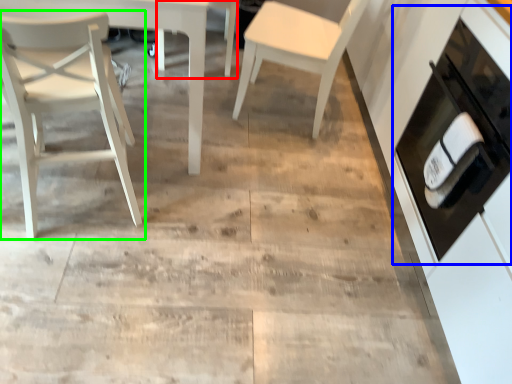
Question: Estimate the real-world distances between objects in this image. Which object is closer to chair (highlighted by a red box), cabinetry (highlighted by a blue box) or chair (highlighted by a green box)?

Choices:
 (A) cabinetry
 (B) chair

Answer: (B)